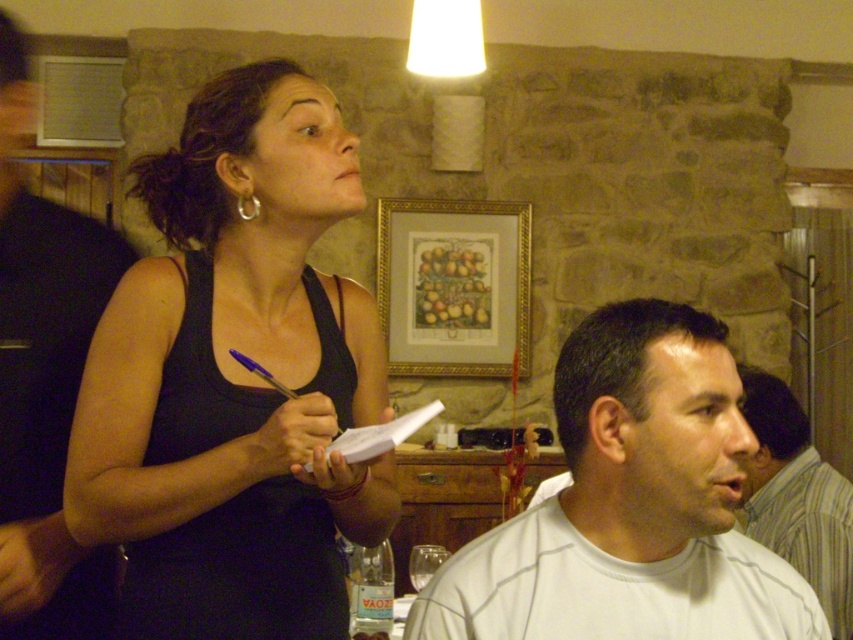
A waiter is standing at point (194, 401). The customer is seated at the table. How far apart are they?

They are 4.10 feet apart.